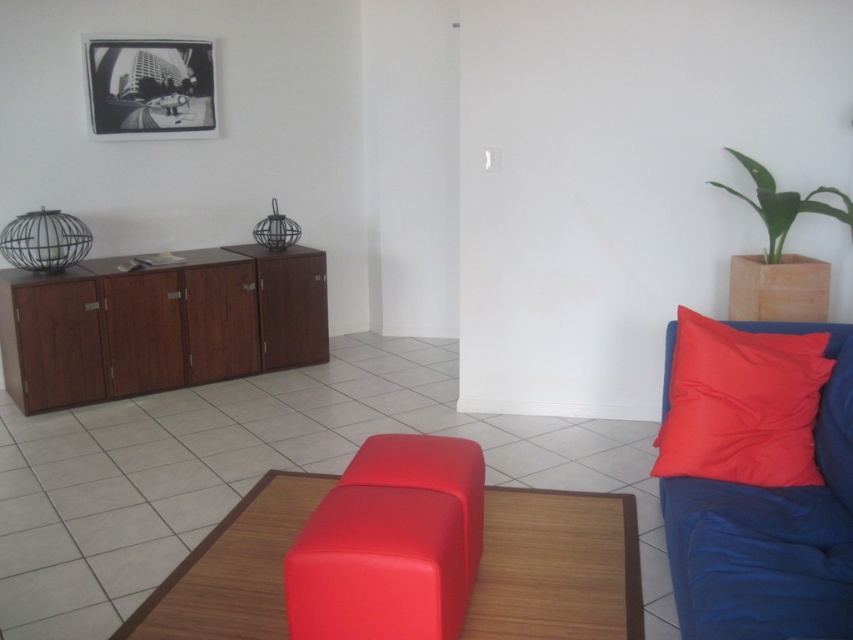
You are standing at the camera position in the living room. You want to place a 2.0 meter long ladder from the camera to the matte red ottoman at center. Is the distance sufficient?

The distance between the camera and the matte red ottoman at center is 2.16 meters, which is longer than the 2.0 meter ladder. Therefore, the ladder will fit and reach the matte red ottoman at center.

You are standing in the center of the living room and want to move towards the wooden cabinet at left. In which direction should you walk?

You should walk to the left to reach the wooden cabinet at left since it is located at point (160,324), which is to the left side of the room.